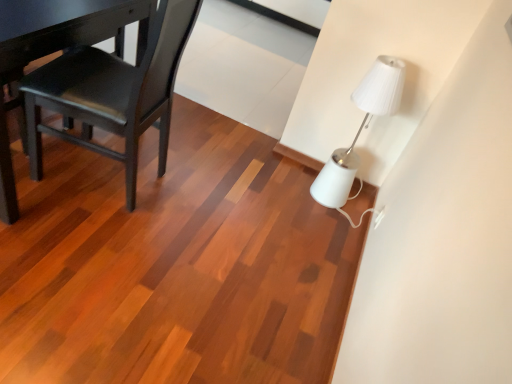
Question: From a real-world perspective, is white glossy lamp at upper right positioned over matte black chair at left based on gravity?

Choices:
 (A) yes
 (B) no

Answer: (B)

Question: Can you confirm if white glossy lamp at upper right is bigger than matte black chair at left?

Choices:
 (A) no
 (B) yes

Answer: (A)

Question: Is white glossy lamp at upper right turned away from matte black chair at left?

Choices:
 (A) yes
 (B) no

Answer: (B)

Question: Is matte black chair at left inside white glossy lamp at upper right?

Choices:
 (A) no
 (B) yes

Answer: (A)

Question: Is white glossy lamp at upper right wider than matte black chair at left?

Choices:
 (A) no
 (B) yes

Answer: (A)

Question: Considering the relative sizes of white glossy lamp at upper right and matte black chair at left in the image provided, is white glossy lamp at upper right shorter than matte black chair at left?

Choices:
 (A) yes
 (B) no

Answer: (A)

Question: Does white glossy lamp at upper right appear on the left side of white plastic electric outlet at lower right?

Choices:
 (A) yes
 (B) no

Answer: (A)

Question: Is white glossy lamp at upper right far away from white plastic electric outlet at lower right?

Choices:
 (A) yes
 (B) no

Answer: (B)

Question: From the image's perspective, does white glossy lamp at upper right appear higher than white plastic electric outlet at lower right?

Choices:
 (A) no
 (B) yes

Answer: (B)

Question: Is white glossy lamp at upper right shorter than white plastic electric outlet at lower right?

Choices:
 (A) no
 (B) yes

Answer: (A)

Question: Does white glossy lamp at upper right have a greater width compared to white plastic electric outlet at lower right?

Choices:
 (A) no
 (B) yes

Answer: (B)

Question: Is white glossy lamp at upper right turned away from white plastic electric outlet at lower right?

Choices:
 (A) no
 (B) yes

Answer: (A)

Question: Considering the relative sizes of matte black chair at left and white plastic electric outlet at lower right in the image provided, is matte black chair at left bigger than white plastic electric outlet at lower right?

Choices:
 (A) no
 (B) yes

Answer: (B)